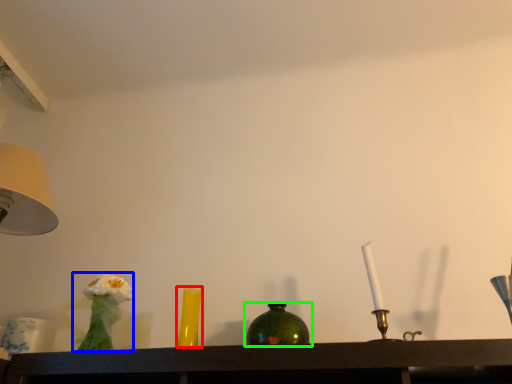
Question: Based on their relative distances, which object is farther from vase (highlighted by a red box)? Choose from floral arrangement (highlighted by a blue box) and bottle (highlighted by a green box).

Choices:
 (A) floral arrangement
 (B) bottle

Answer: (B)